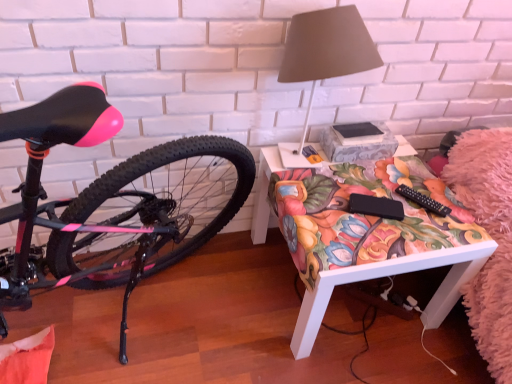
Question: Should I look upward or downward to see matte gray lampshade at upper right?

Choices:
 (A) down
 (B) up

Answer: (B)

Question: Does matte gray lampshade at upper right have a larger size compared to floral fabric desk at center?

Choices:
 (A) yes
 (B) no

Answer: (B)

Question: Can you confirm if matte gray lampshade at upper right is taller than floral fabric desk at center?

Choices:
 (A) no
 (B) yes

Answer: (B)

Question: Could you tell me if matte gray lampshade at upper right is turned towards floral fabric desk at center?

Choices:
 (A) yes
 (B) no

Answer: (B)

Question: Is the position of matte gray lampshade at upper right more distant than that of floral fabric desk at center?

Choices:
 (A) no
 (B) yes

Answer: (A)

Question: Does matte gray lampshade at upper right appear on the right side of floral fabric desk at center?

Choices:
 (A) yes
 (B) no

Answer: (B)

Question: From a real-world perspective, is matte gray lampshade at upper right beneath floral fabric desk at center?

Choices:
 (A) yes
 (B) no

Answer: (B)

Question: Considering the relative sizes of matte gray lampshade at upper right and black plastic remote control at lower right in the image provided, is matte gray lampshade at upper right taller than black plastic remote control at lower right?

Choices:
 (A) no
 (B) yes

Answer: (B)

Question: Is matte gray lampshade at upper right positioned far away from black plastic remote control at lower right?

Choices:
 (A) yes
 (B) no

Answer: (B)

Question: Does matte gray lampshade at upper right have a larger size compared to black plastic remote control at lower right?

Choices:
 (A) no
 (B) yes

Answer: (B)

Question: Considering the relative sizes of matte gray lampshade at upper right and black plastic remote control at lower right in the image provided, is matte gray lampshade at upper right shorter than black plastic remote control at lower right?

Choices:
 (A) yes
 (B) no

Answer: (B)

Question: From the image's perspective, is matte gray lampshade at upper right above black plastic remote control at lower right?

Choices:
 (A) no
 (B) yes

Answer: (B)

Question: Considering the relative sizes of matte gray lampshade at upper right and black plastic remote control at lower right in the image provided, is matte gray lampshade at upper right thinner than black plastic remote control at lower right?

Choices:
 (A) yes
 (B) no

Answer: (B)

Question: Is black plastic remote control at lower right facing towards floral fabric desk at center?

Choices:
 (A) yes
 (B) no

Answer: (B)